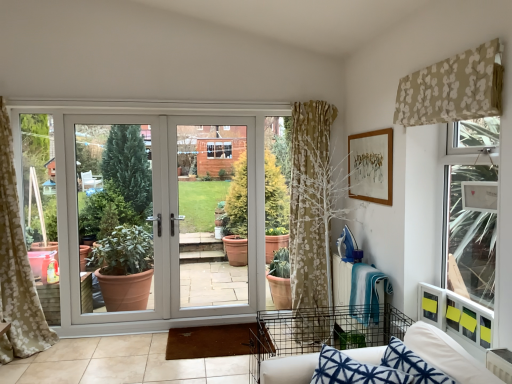
Question: Is white plastic door at center oriented towards beige floral fabric at upper right?

Choices:
 (A) no
 (B) yes

Answer: (B)

Question: Can you confirm if white plastic door at center is shorter than beige floral fabric at upper right?

Choices:
 (A) no
 (B) yes

Answer: (A)

Question: Can you confirm if white plastic door at center is smaller than beige floral fabric at upper right?

Choices:
 (A) yes
 (B) no

Answer: (B)

Question: Is white plastic door at center positioned behind beige floral fabric at upper right?

Choices:
 (A) yes
 (B) no

Answer: (A)

Question: Is white plastic door at center with beige floral fabric at upper right?

Choices:
 (A) yes
 (B) no

Answer: (B)

Question: Is there a large distance between white plastic door at center and beige floral fabric at upper right?

Choices:
 (A) no
 (B) yes

Answer: (B)

Question: From the image's perspective, does white plastic door at center appear higher than white glossy door at center?

Choices:
 (A) yes
 (B) no

Answer: (B)

Question: Is white plastic door at center closer to the viewer compared to white glossy door at center?

Choices:
 (A) yes
 (B) no

Answer: (A)

Question: Is white plastic door at center completely or partially outside of white glossy door at center?

Choices:
 (A) yes
 (B) no

Answer: (A)

Question: Considering the relative positions of white plastic door at center and white glossy door at center in the image provided, is white plastic door at center to the left of white glossy door at center from the viewer's perspective?

Choices:
 (A) no
 (B) yes

Answer: (B)

Question: Does white plastic door at center have a smaller size compared to white glossy door at center?

Choices:
 (A) yes
 (B) no

Answer: (B)

Question: Is white plastic door at center looking in the opposite direction of white glossy door at center?

Choices:
 (A) yes
 (B) no

Answer: (A)

Question: Is beige floral fabric at upper right facing away from blue printed fabric couch at lower right?

Choices:
 (A) no
 (B) yes

Answer: (A)